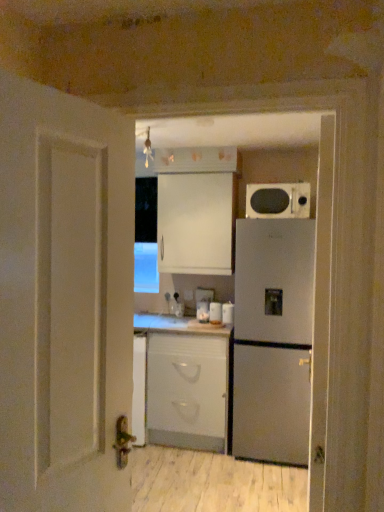
Question: From the image's perspective, is white matte cabinet at upper center, positioned as the first cabinetry in top-to-bottom order, above white glossy jar at center, which is the third appliance in right-to-left order?

Choices:
 (A) no
 (B) yes

Answer: (B)

Question: Can you confirm if white matte cabinet at upper center, arranged as the second cabinetry when ordered from the bottom, is positioned to the right of white glossy jar at center, the 1th appliance viewed from the left?

Choices:
 (A) no
 (B) yes

Answer: (A)

Question: Does white matte cabinet at upper center, positioned as the first cabinetry in top-to-bottom order, have a lesser width compared to white glossy jar at center, which is the third appliance in right-to-left order?

Choices:
 (A) yes
 (B) no

Answer: (B)

Question: Is white matte cabinet at upper center, positioned as the first cabinetry in top-to-bottom order, further to the viewer compared to white glossy jar at center, the 1th appliance viewed from the left?

Choices:
 (A) no
 (B) yes

Answer: (A)

Question: Is white matte cabinet at upper center, positioned as the first cabinetry in top-to-bottom order, outside of white glossy jar at center, which is the third appliance in right-to-left order?

Choices:
 (A) yes
 (B) no

Answer: (A)

Question: Based on their positions, is satin silver refrigerator at right located to the left or right of matte black microwave at upper right?

Choices:
 (A) left
 (B) right

Answer: (A)

Question: In terms of size, does satin silver refrigerator at right appear bigger or smaller than matte black microwave at upper right?

Choices:
 (A) small
 (B) big

Answer: (B)

Question: From the image's perspective, is satin silver refrigerator at right above or below matte black microwave at upper right?

Choices:
 (A) below
 (B) above

Answer: (A)

Question: In terms of width, does satin silver refrigerator at right look wider or thinner when compared to matte black microwave at upper right?

Choices:
 (A) thin
 (B) wide

Answer: (B)

Question: Is point (208, 302) closer or farther from the camera than point (228, 312)?

Choices:
 (A) farther
 (B) closer

Answer: (A)

Question: From a real-world perspective, is white glossy jar at center, which is the third appliance in right-to-left order, above or below white glossy canister at center, which is the first appliance in right-to-left order?

Choices:
 (A) below
 (B) above

Answer: (B)

Question: From the image's perspective, relative to white glossy canister at center, which is the first appliance in right-to-left order, is white glossy jar at center, which is the third appliance in right-to-left order, above or below?

Choices:
 (A) below
 (B) above

Answer: (B)

Question: Considering the relative positions of white glossy jar at center, the 1th appliance viewed from the left, and white glossy canister at center, which is the first appliance in right-to-left order, in the image provided, is white glossy jar at center, the 1th appliance viewed from the left, to the left or to the right of white glossy canister at center, which is the first appliance in right-to-left order,?

Choices:
 (A) right
 (B) left

Answer: (B)

Question: Considering their positions, is white glossy jar at center, marked as the 2th appliance in a left-to-right arrangement, located in front of or behind matte black microwave at upper right?

Choices:
 (A) behind
 (B) front

Answer: (A)

Question: Considering the positions of white glossy jar at center, marked as the 2th appliance in a left-to-right arrangement, and matte black microwave at upper right in the image, is white glossy jar at center, marked as the 2th appliance in a left-to-right arrangement, wider or thinner than matte black microwave at upper right?

Choices:
 (A) thin
 (B) wide

Answer: (A)